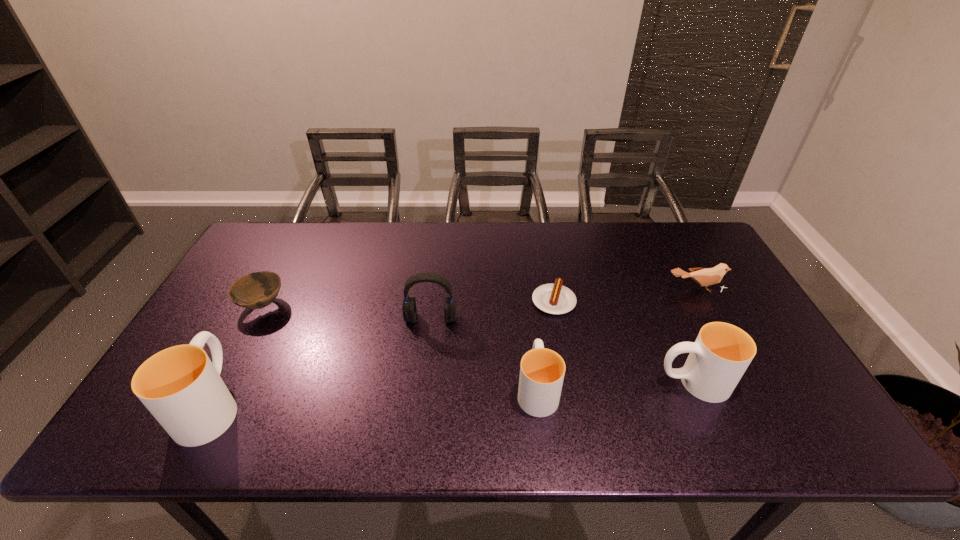
At what (x,y) coordinates should I click in order to perform the action: click on free point located with the handle on the side of the leftmost cup. Please return your answer as a coordinate pair (x, y). Image resolution: width=960 pixels, height=540 pixels. Looking at the image, I should click on (249, 335).

Where is `vacant space situated 0.380m with the handle on the side of the second cup from right to left`? Image resolution: width=960 pixels, height=540 pixels. vacant space situated 0.380m with the handle on the side of the second cup from right to left is located at coordinates (523, 268).

Where is `blank space located 0.330m with the handle on the side of the second cup from right to left`? Image resolution: width=960 pixels, height=540 pixels. blank space located 0.330m with the handle on the side of the second cup from right to left is located at coordinates (524, 278).

Where is `free region located with the handle on the side of the second cup from right to left`? free region located with the handle on the side of the second cup from right to left is located at coordinates (523, 264).

In order to click on vacant region located with the handle on the side of the rightmost cup in this screenshot , I will do `click(520, 382)`.

Identify the location of vacant position located 0.320m with the handle on the side of the rightmost cup. This screenshot has height=540, width=960. click(524, 382).

You are a GUI agent. You are given a task and a screenshot of the screen. Output one action in this format:
    pyautogui.click(x=<x>, y=<y>)
    Task: Click on the blank space located 0.070m with the handle on the side of the rightmost cup
    
    Given the screenshot: What is the action you would take?
    pyautogui.click(x=627, y=382)

Identify the location of vacant area located on the back of the sausage. The image size is (960, 540). (542, 237).

Find the location of `vacant area located 0.220m on the headband of the third object from left to right`. vacant area located 0.220m on the headband of the third object from left to right is located at coordinates (421, 396).

Identify the location of vacant space located on the front of the bowl. Image resolution: width=960 pixels, height=540 pixels. (237, 353).